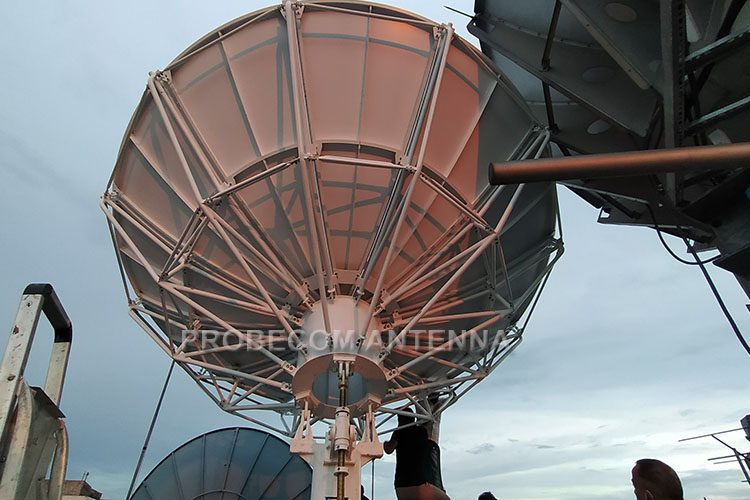
The width and height of the screenshot is (750, 500). In order to click on ladder in this screenshot , I will do `click(28, 322)`.